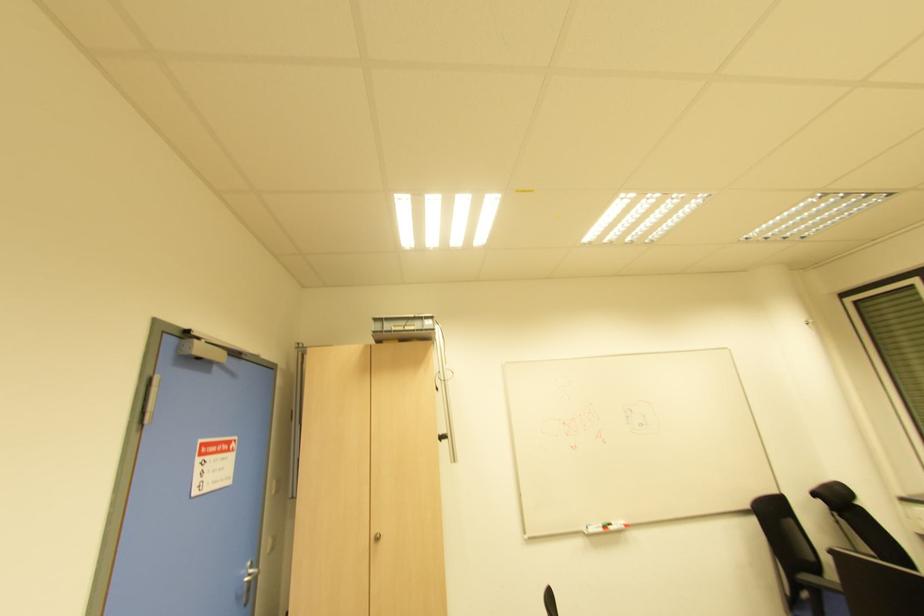
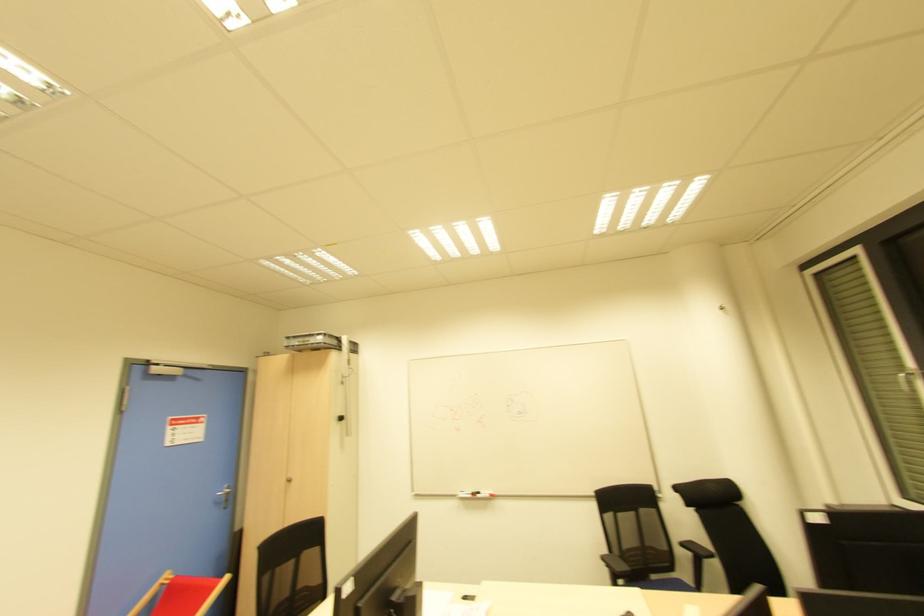
In the second image, find the point that corresponds to point (610, 528) in the first image.

(478, 496)